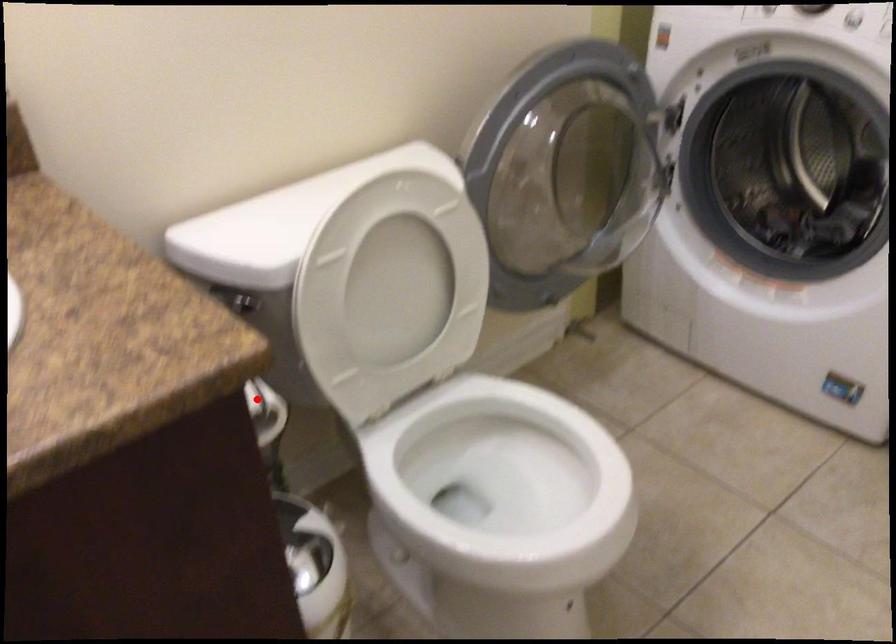
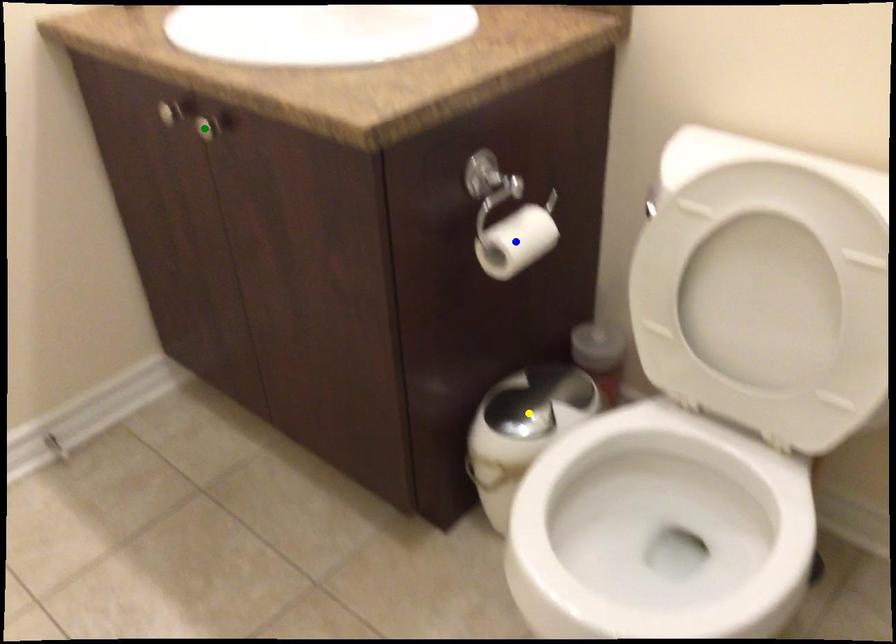
Question: I am providing you with two images of the same scene from different viewpoints. A red point is marked on the first image. You are given multiple points on the second image. Which point in image 2 is actually the same real-world point as the red point in image 1?

Choices:
 (A) green point
 (B) yellow point
 (C) blue point

Answer: (C)